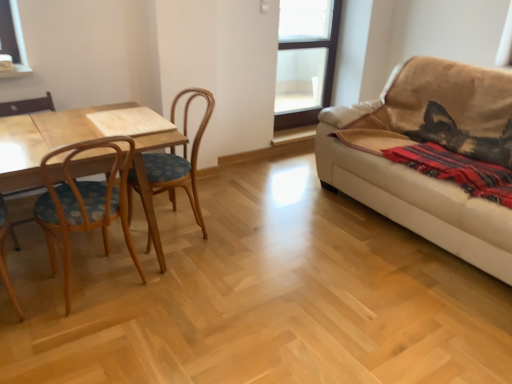
Identify the location of vacant area that is in front of beige fabric couch at right. The height and width of the screenshot is (384, 512). (388, 308).